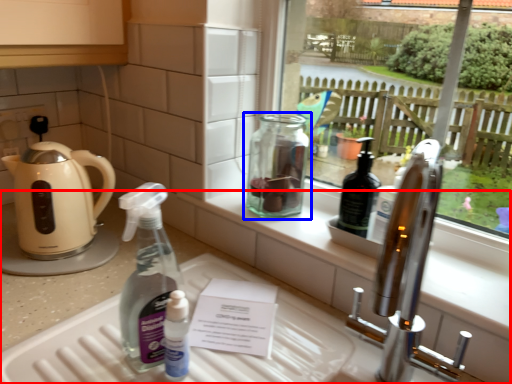
Question: Among these objects, which one is farthest to the camera, counter (highlighted by a red box) or bottle (highlighted by a blue box)?

Choices:
 (A) counter
 (B) bottle

Answer: (B)